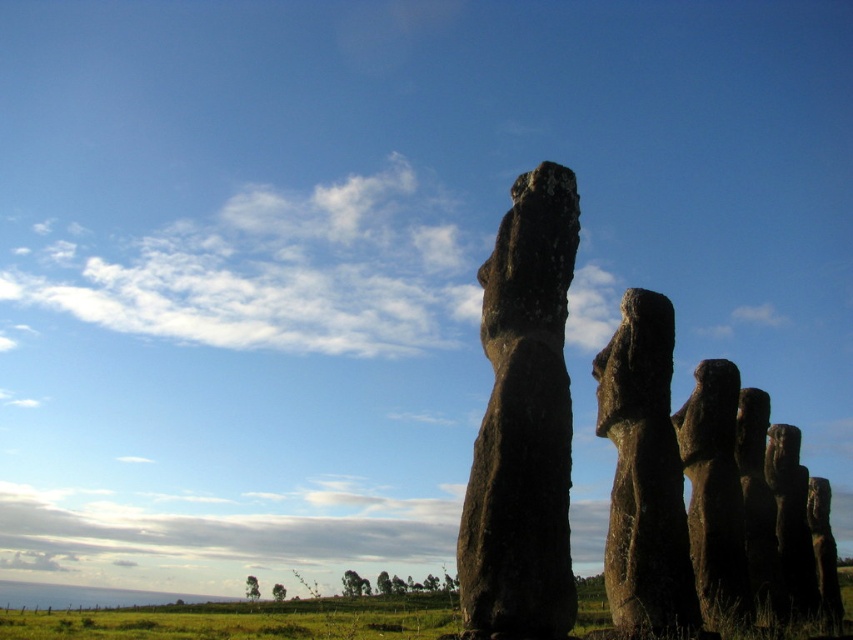
Can you confirm if rough stone statue at center is bigger than dark brown stone statue at right?

Correct, rough stone statue at center is larger in size than dark brown stone statue at right.

Is rough stone statue at center taller than dark brown stone statue at right?

Correct, rough stone statue at center is much taller as dark brown stone statue at right.

I want to click on rough stone statue at center, so click(x=523, y=422).